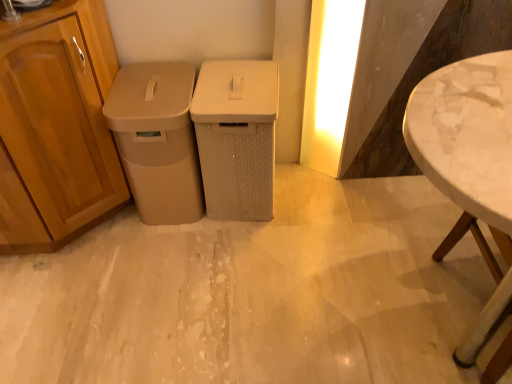
You are a GUI agent. You are given a task and a screenshot of the screen. Output one action in this format:
    pyautogui.click(x=<x>, y=<y>)
    Task: Click on the free space that is in between white marble table at right and yellow matte light at upper right
    
    Given the screenshot: What is the action you would take?
    pyautogui.click(x=378, y=227)